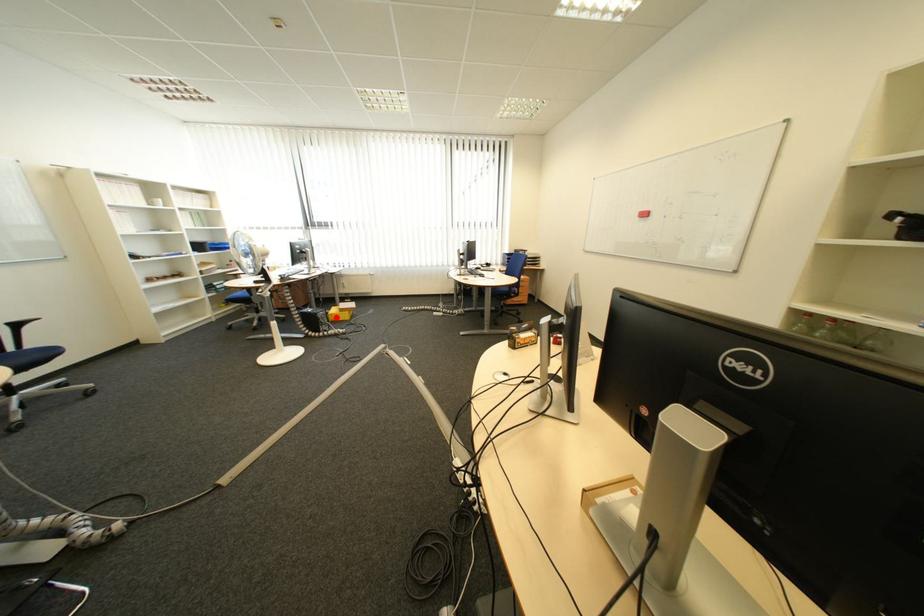
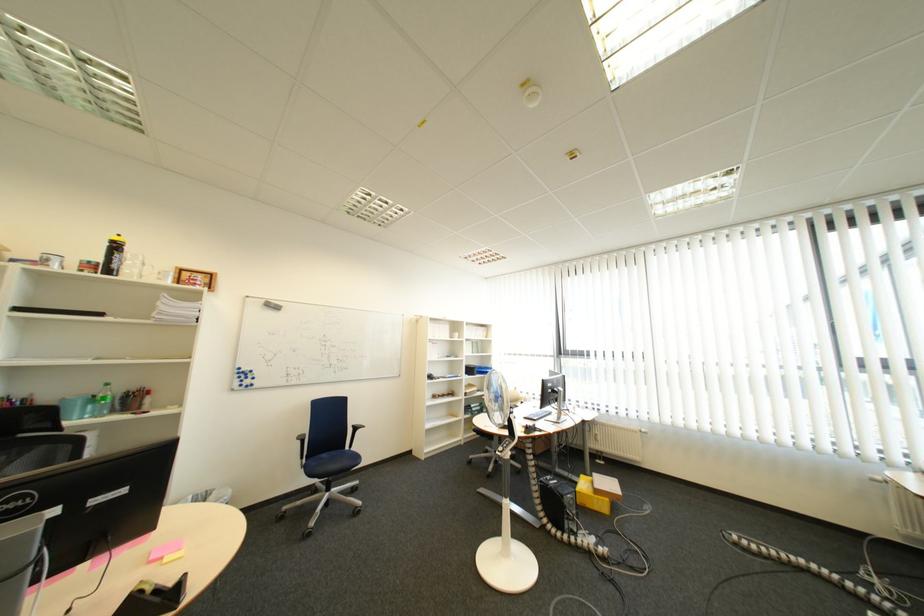
Locate, in the second image, the point that corresponds to the highlighted location in the first image.

(585, 503)